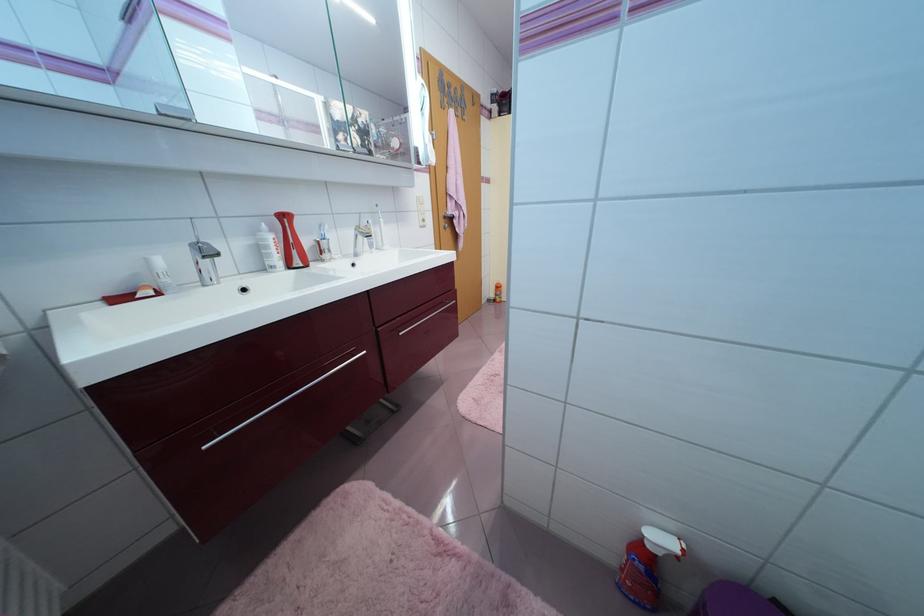
Describe the element at coordinates (281, 402) in the screenshot. I see `the silver door handle` at that location.